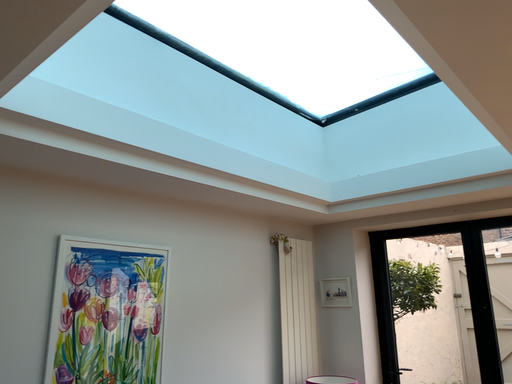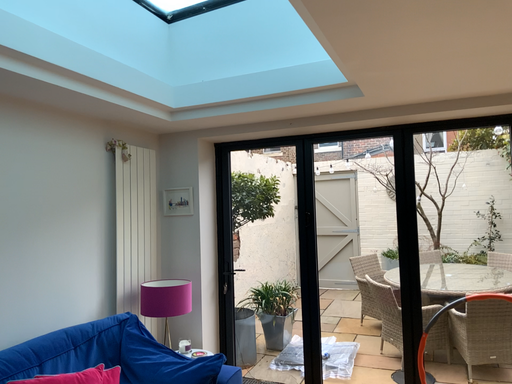
Question: Which way did the camera rotate in the video?

Choices:
 (A) rotated right
 (B) rotated left

Answer: (A)